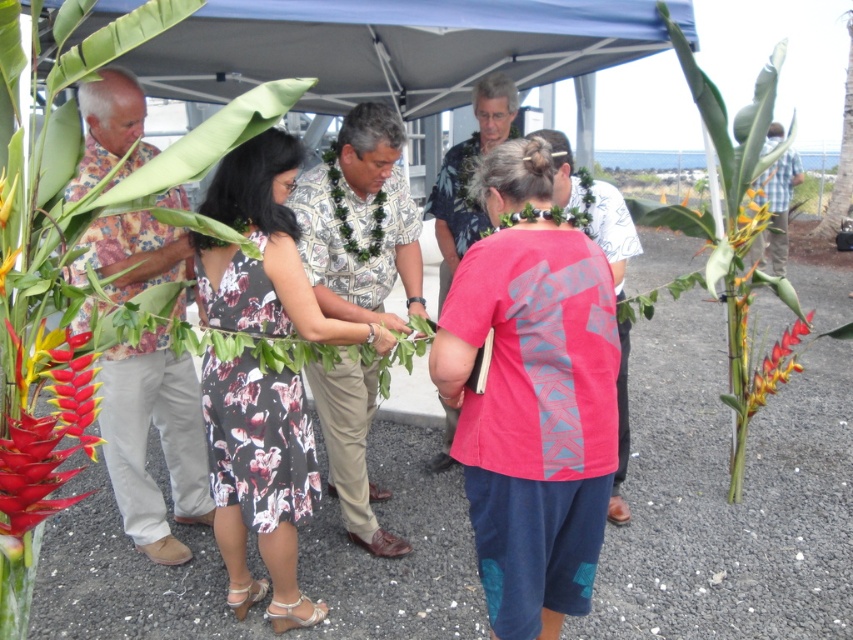
Consider the image. You are standing at the blue canopy tent and want to walk towards the point that is closer to you. Which point should you head towards, point (x=442, y=314) or point (x=20, y=248)?

You should head towards point (x=20, y=248) because it is closer to you than point (x=442, y=314), which is further away.